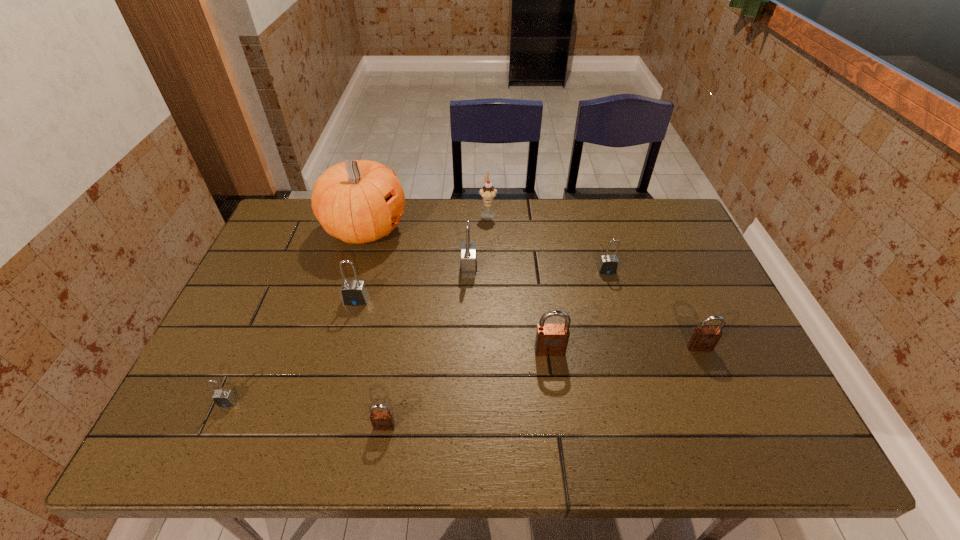
At what (x,y) coordinates should I click in order to perform the action: click on free spot between the leftmost object and the nearest object. Please return your answer as a coordinate pair (x, y). The image size is (960, 540). Looking at the image, I should click on (306, 414).

Locate an element on the screen. The width and height of the screenshot is (960, 540). empty space between the tallest object and the third gray padlock from right to left is located at coordinates (361, 265).

Locate an element on the screen. The image size is (960, 540). free area in between the third farthest gray padlock and the icecream is located at coordinates (422, 257).

Where is `free area in between the second object from right to left and the rightmost padlock`? The width and height of the screenshot is (960, 540). free area in between the second object from right to left and the rightmost padlock is located at coordinates (653, 309).

Find the location of `vacant area that lies between the biggest brown padlock and the nearest brown padlock`. vacant area that lies between the biggest brown padlock and the nearest brown padlock is located at coordinates (468, 389).

Find the location of a particular element. The height and width of the screenshot is (540, 960). vacant point located between the rightmost padlock and the fourth object from right to left is located at coordinates (593, 281).

The image size is (960, 540). In order to click on blank region between the nearest padlock and the smallest gray padlock in this screenshot , I will do pyautogui.click(x=306, y=414).

The image size is (960, 540). I want to click on the closest object relative to the fifth farthest object, so click(x=357, y=201).

Identify which object is the closest to the fifth padlock from left to right. Please provide its 2D coordinates. Your answer should be formatted as a tuple, i.e. [(x, y)], where the tuple contains the x and y coordinates of a point satisfying the conditions above.

[(468, 265)]

Find the location of a particular element. Image resolution: width=960 pixels, height=540 pixels. the sixth closest padlock to the eighth object from left to right is located at coordinates (223, 398).